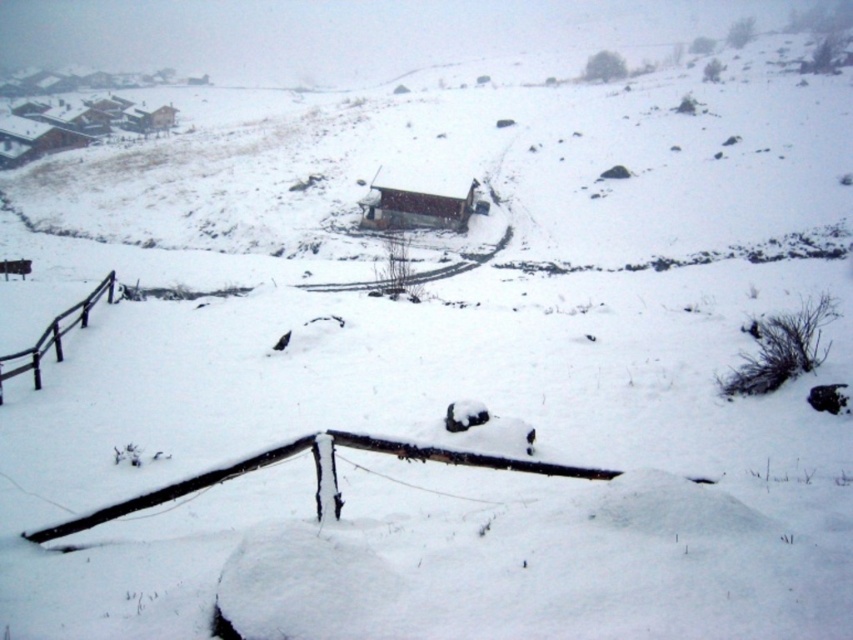
Between snow-covered wood rail at lower center and wooden cabin at center, which one is positioned lower?

Positioned lower is snow-covered wood rail at lower center.

Who is taller, snow-covered wood rail at lower center or wooden cabin at center?

wooden cabin at center

Who is more forward, (131, 499) or (415, 216)?

Point (131, 499)

You are a GUI agent. You are given a task and a screenshot of the screen. Output one action in this format:
    pyautogui.click(x=<x>, y=<y>)
    Task: Click on the snow-covered wood rail at lower center
    
    Given the screenshot: What is the action you would take?
    pyautogui.click(x=316, y=476)

Between snow-covered wood rail at lower center and black wood rail at left, which one has less height?

snow-covered wood rail at lower center

Which is in front, point (53, 529) or point (6, 371)?

Point (53, 529) is in front.

In order to click on snow-covered wood rail at lower center in this screenshot , I will do `click(316, 476)`.

Locate an element on the screen. The width and height of the screenshot is (853, 640). snow-covered wood rail at lower center is located at coordinates (316, 476).

Can you confirm if wooden cabin at center is bigger than black wood rail at left?

Correct, wooden cabin at center is larger in size than black wood rail at left.

In order to click on wooden cabin at center in this screenshot , I will do tap(418, 200).

Is point (410, 225) behind point (61, 330)?

Yes, it is behind point (61, 330).

You are a GUI agent. You are given a task and a screenshot of the screen. Output one action in this format:
    pyautogui.click(x=<x>, y=<y>)
    Task: Click on the wooden cabin at center
    Image resolution: width=853 pixels, height=640 pixels.
    Given the screenshot: What is the action you would take?
    pyautogui.click(x=418, y=200)